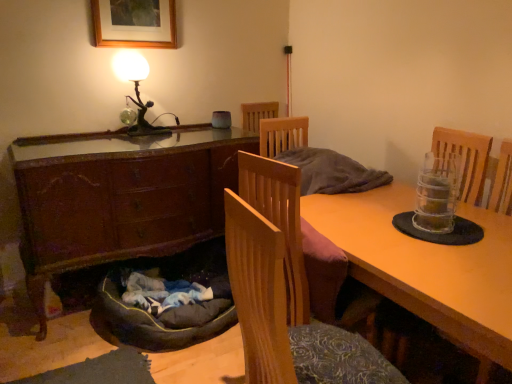
This screenshot has width=512, height=384. I want to click on free space in front of metallic figure at upper left, so click(152, 142).